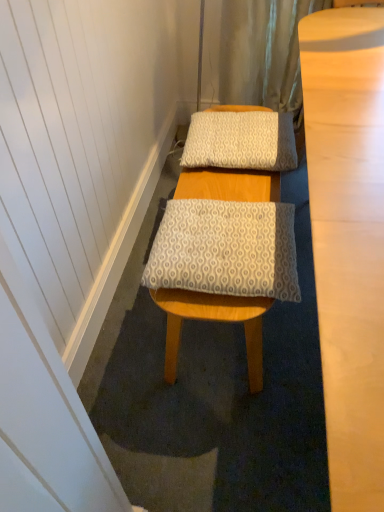
Question: Is patterned fabric pillow at center, marked as the 1th pillow in a bottom-to-top arrangement, at the back of white textured bath mat at center?

Choices:
 (A) yes
 (B) no

Answer: (B)

Question: Is white textured bath mat at center bigger than patterned fabric pillow at center, marked as the 1th pillow in a bottom-to-top arrangement?

Choices:
 (A) no
 (B) yes

Answer: (B)

Question: Is white textured bath mat at center facing towards patterned fabric pillow at center, marked as the 1th pillow in a bottom-to-top arrangement?

Choices:
 (A) yes
 (B) no

Answer: (B)

Question: Is white textured bath mat at center to the right of patterned fabric pillow at center, acting as the second pillow starting from the back, from the viewer's perspective?

Choices:
 (A) no
 (B) yes

Answer: (B)

Question: Is white textured bath mat at center to the left of patterned fabric pillow at center, the second pillow positioned from the top, from the viewer's perspective?

Choices:
 (A) no
 (B) yes

Answer: (A)

Question: Does white textured bath mat at center have a lesser width compared to patterned fabric pillow at center, acting as the second pillow starting from the back?

Choices:
 (A) yes
 (B) no

Answer: (B)

Question: Considering the relative sizes of patterned fabric pillow at center, acting as the second pillow starting from the back, and white textured pillow at center, the first pillow in the top-to-bottom sequence, in the image provided, is patterned fabric pillow at center, acting as the second pillow starting from the back, wider than white textured pillow at center, the first pillow in the top-to-bottom sequence,?

Choices:
 (A) no
 (B) yes

Answer: (A)

Question: From the image's perspective, is patterned fabric pillow at center, acting as the second pillow starting from the back, located above white textured pillow at center, which is the 1th pillow from back to front?

Choices:
 (A) no
 (B) yes

Answer: (A)

Question: Is the depth of patterned fabric pillow at center, the first pillow when ordered from front to back, less than that of white textured pillow at center, acting as the 2th pillow starting from the front?

Choices:
 (A) no
 (B) yes

Answer: (B)

Question: Is patterned fabric pillow at center, the second pillow positioned from the top, located outside white textured pillow at center, which is the 2th pillow from bottom to top?

Choices:
 (A) yes
 (B) no

Answer: (A)

Question: Is white textured pillow at center, the first pillow in the top-to-bottom sequence, inside patterned fabric pillow at center, marked as the 1th pillow in a bottom-to-top arrangement?

Choices:
 (A) no
 (B) yes

Answer: (A)

Question: Can you confirm if patterned fabric pillow at center, marked as the 1th pillow in a bottom-to-top arrangement, is shorter than white textured pillow at center, the first pillow in the top-to-bottom sequence?

Choices:
 (A) no
 (B) yes

Answer: (B)

Question: Is patterned fabric pillow at center, acting as the second pillow starting from the back, outside white textured bath mat at center?

Choices:
 (A) no
 (B) yes

Answer: (B)